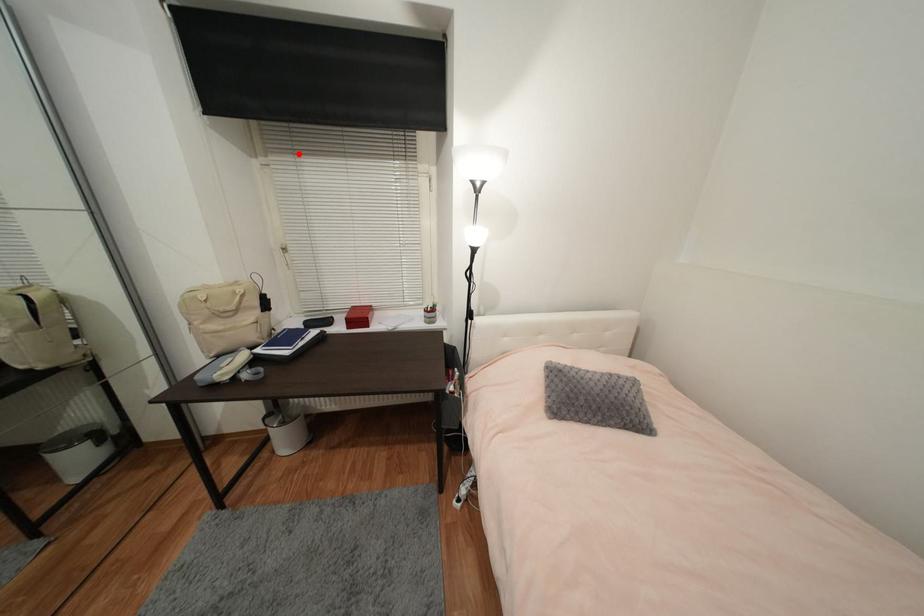
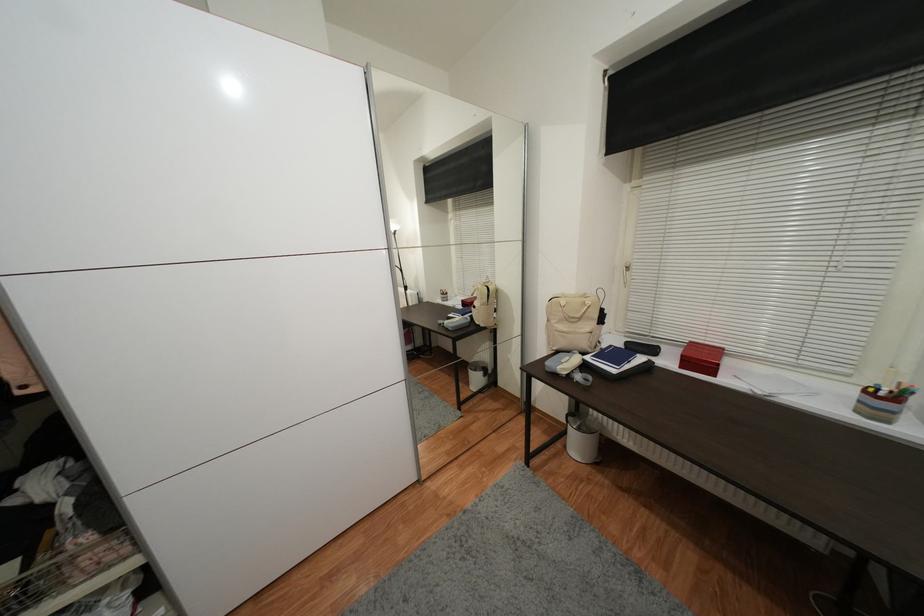
In the second image, find the point that corresponds to the highlighted location in the first image.

(678, 167)